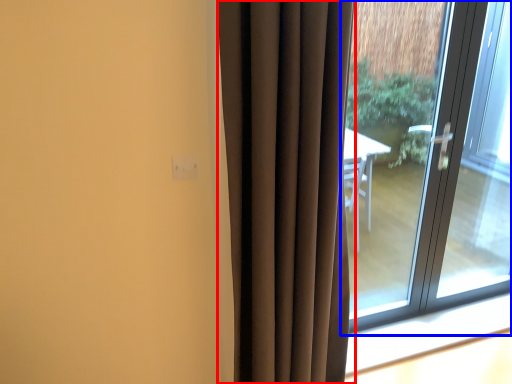
Question: Which point is closer to the camera, curtain (highlighted by a red box) or window (highlighted by a blue box)?

Choices:
 (A) curtain
 (B) window

Answer: (A)